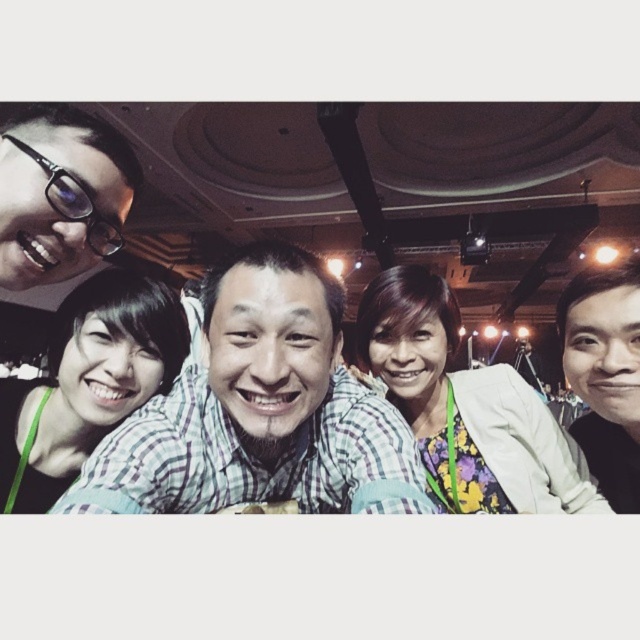
Question: Estimate the real-world distances between objects in this image. Which object is closer to the matte green shirt at lower left?

Choices:
 (A) checkered fabric shirt at center
 (B) matte black glasses at upper left

Answer: (B)

Question: Which of the following is the closest to the observer?

Choices:
 (A) floral fabric blouse at center
 (B) matte green shirt at lower left

Answer: (B)

Question: Is checkered fabric shirt at center above matte green shirt at lower left?

Choices:
 (A) no
 (B) yes

Answer: (A)

Question: Which point is closer to the camera?

Choices:
 (A) matte green shirt at lower left
 (B) checkered fabric shirt at center
 (C) floral fabric blouse at center

Answer: (B)

Question: Can you confirm if matte green shirt at lower left is positioned to the right of matte black glasses at upper left?

Choices:
 (A) yes
 (B) no

Answer: (B)

Question: Is checkered fabric shirt at center to the right of matte green shirt at lower left from the viewer's perspective?

Choices:
 (A) no
 (B) yes

Answer: (B)